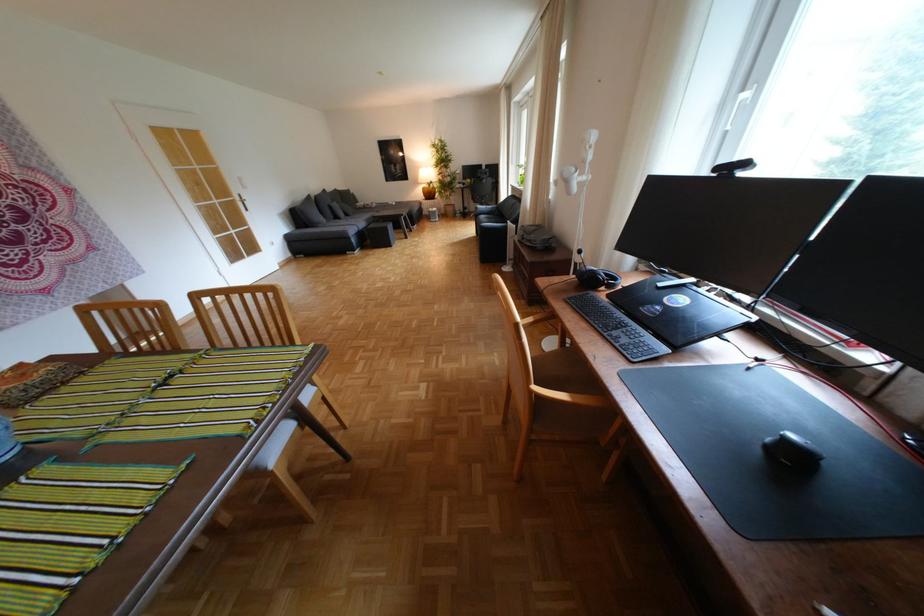
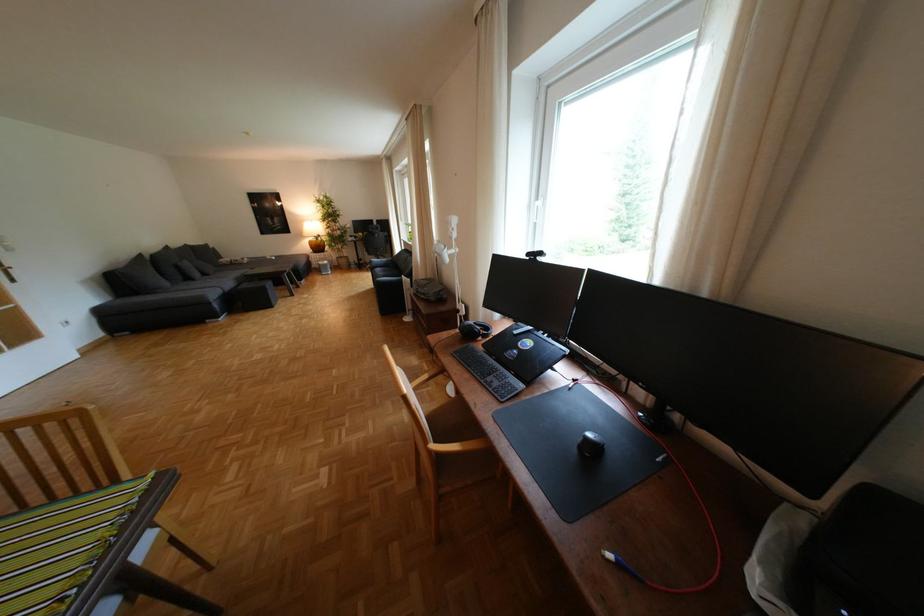
Question: The images are taken continuously from a first-person perspective. In which direction is your viewpoint rotating?

Choices:
 (A) Left
 (B) Right
 (C) Up
 (D) Down

Answer: (B)